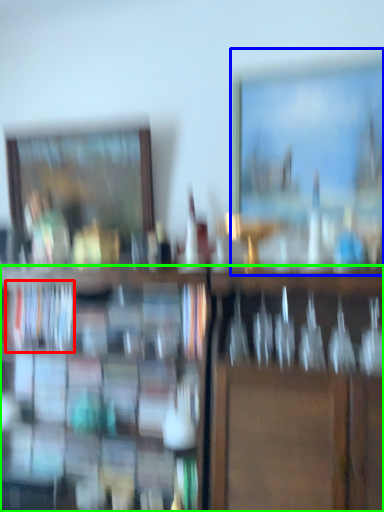
Question: Which object is the closest to the book (highlighted by a red box)? Choose among these: picture frame (highlighted by a blue box) or shelf (highlighted by a green box).

Choices:
 (A) picture frame
 (B) shelf

Answer: (B)